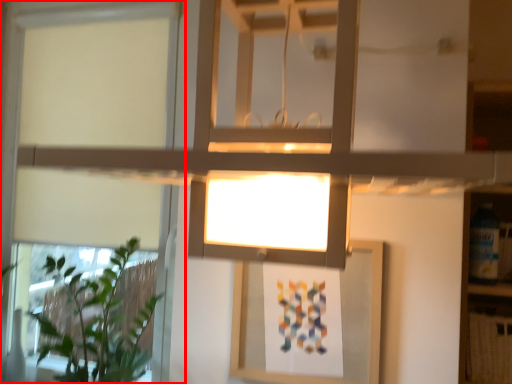
Question: From the image's perspective, considering the relative positions of window (annotated by the red box) and houseplant in the image provided, where is window (annotated by the red box) located with respect to the staircase?

Choices:
 (A) below
 (B) above

Answer: (B)